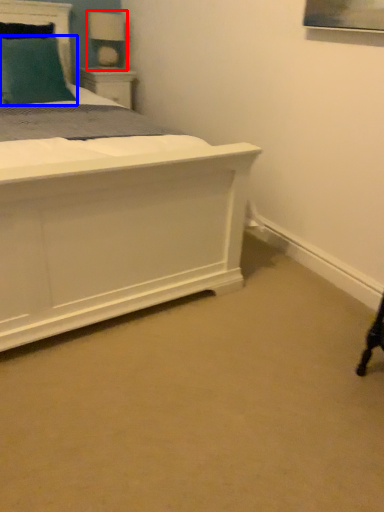
Question: Which of the following is the farthest to the observer, table lamp (highlighted by a red box) or pillow (highlighted by a blue box)?

Choices:
 (A) table lamp
 (B) pillow

Answer: (A)